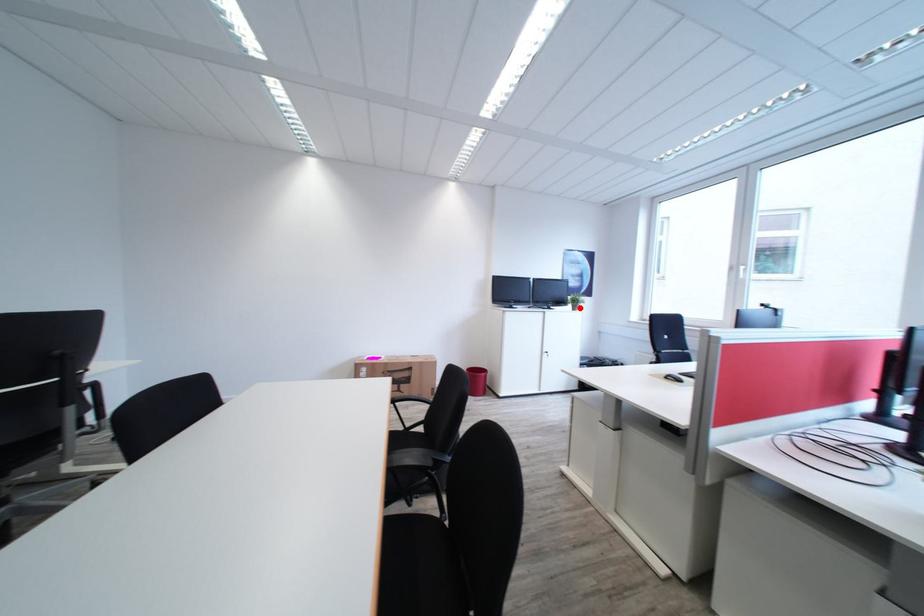
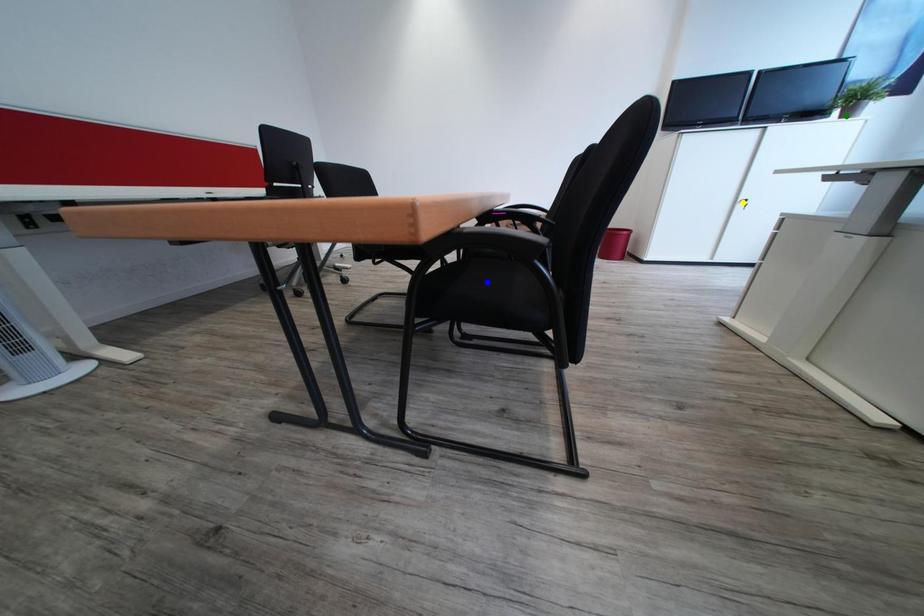
Question: I am providing you with two images of the same scene from different viewpoints. A red point is marked on the first image. You are given multiple points on the second image. Which point in image 2 represents the same 3d spot as the red point in image 1?

Choices:
 (A) blue point
 (B) green point
 (C) yellow point

Answer: (B)